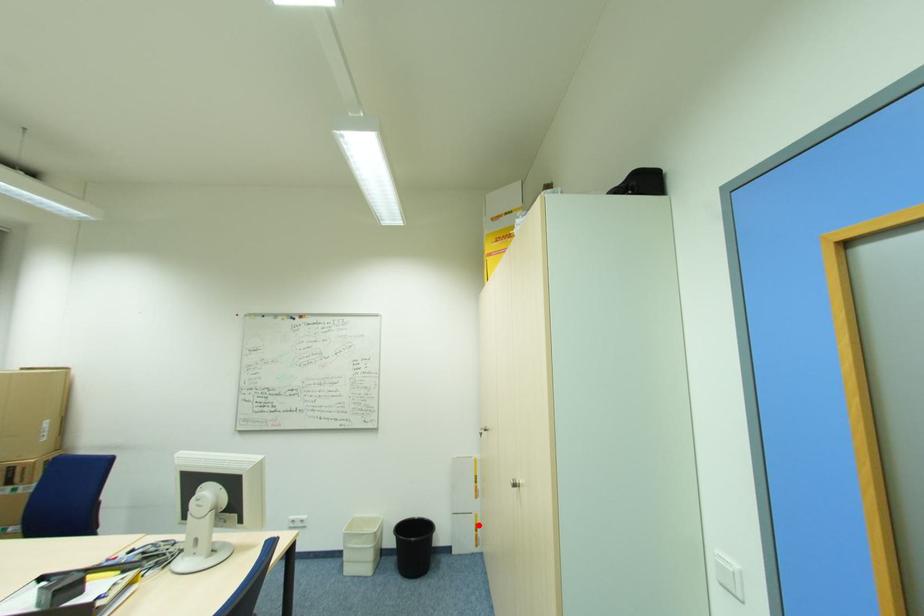
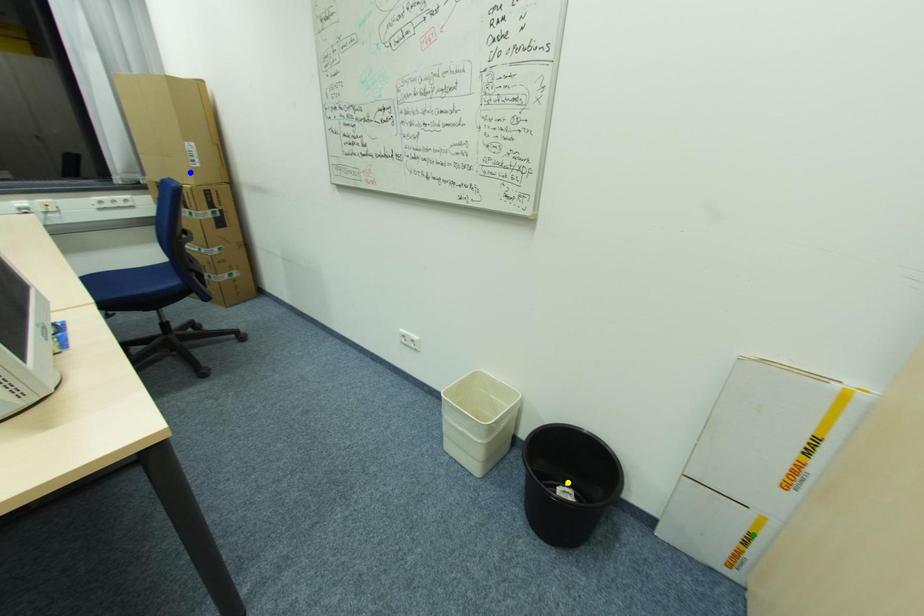
Question: I am providing you with two images of the same scene from different viewpoints. A red point is marked on the first image. You are given multiple points on the second image. Which point in image 2 represents the same 3d spot as the red point in image 1?

Choices:
 (A) yellow point
 (B) blue point
 (C) green point

Answer: (C)